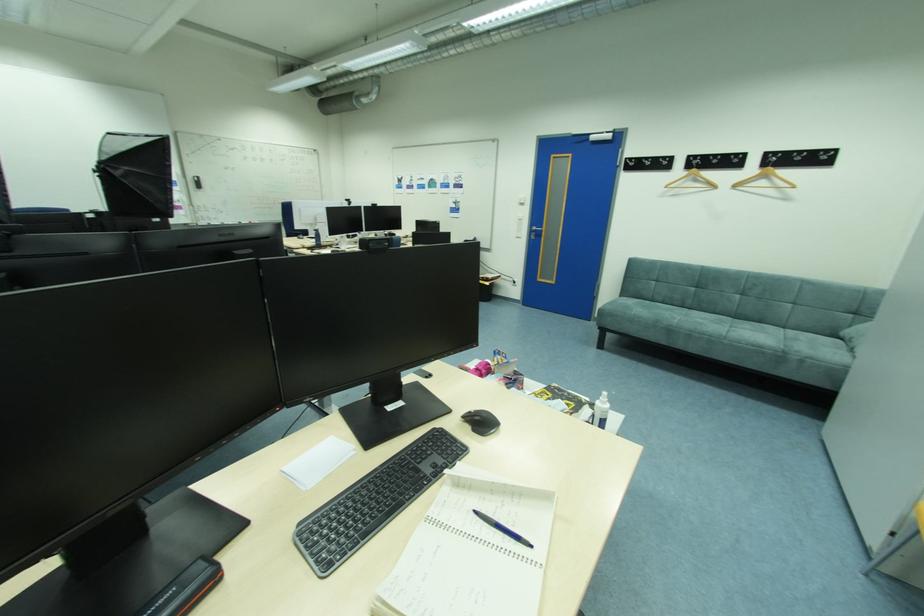
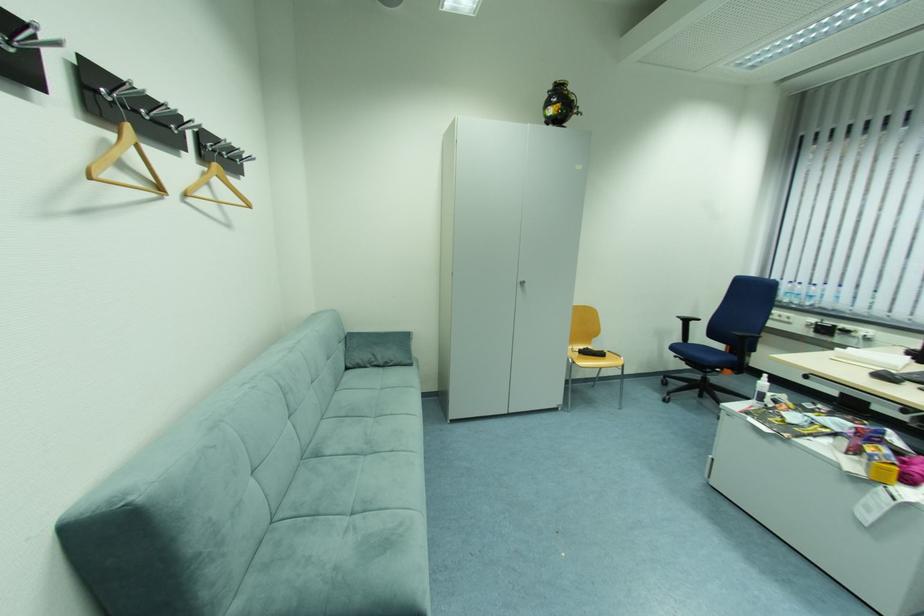
Locate, in the second image, the point that corresponds to point 672,188 in the first image.

(96, 180)